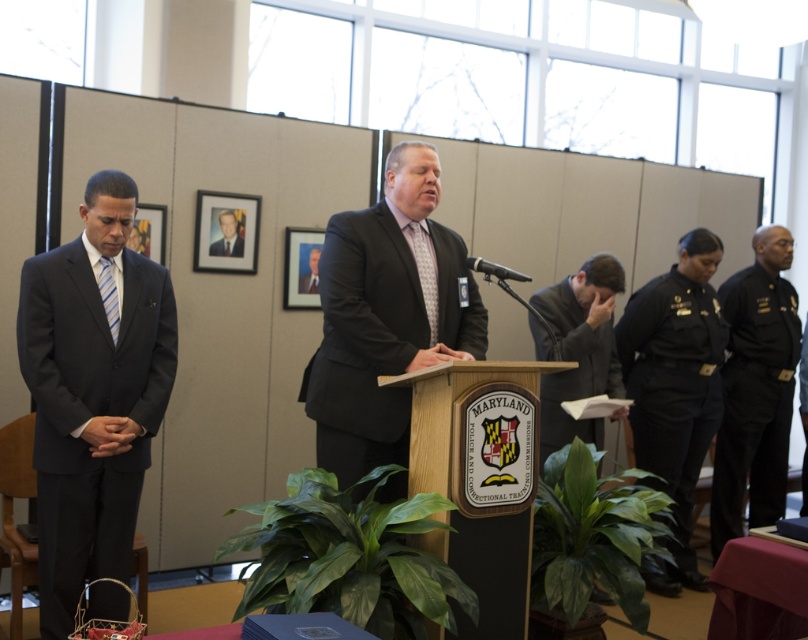
Consider the image. Can you confirm if dark gray suit at left is thinner than dark gray suit at center?

No.

Is point (41, 442) in front of point (208, 248)?

Yes.

This screenshot has width=808, height=640. I want to click on dark gray suit at left, so click(91, 396).

Is smooth black suit at center bigger than black plastic microphone at center?

No, smooth black suit at center is not bigger than black plastic microphone at center.

Can you confirm if smooth black suit at center is positioned to the right of black plastic microphone at center?

In fact, smooth black suit at center is to the left of black plastic microphone at center.

I want to click on smooth black suit at center, so click(x=308, y=268).

Is blue striped tie at left closer to camera compared to black plastic microphone at center?

No, blue striped tie at left is further to the viewer.

Based on the photo, does blue striped tie at left appear over black plastic microphone at center?

No.

This screenshot has width=808, height=640. In order to click on blue striped tie at left in this screenshot , I will do `click(108, 296)`.

The width and height of the screenshot is (808, 640). In order to click on blue striped tie at left in this screenshot , I will do `click(108, 296)`.